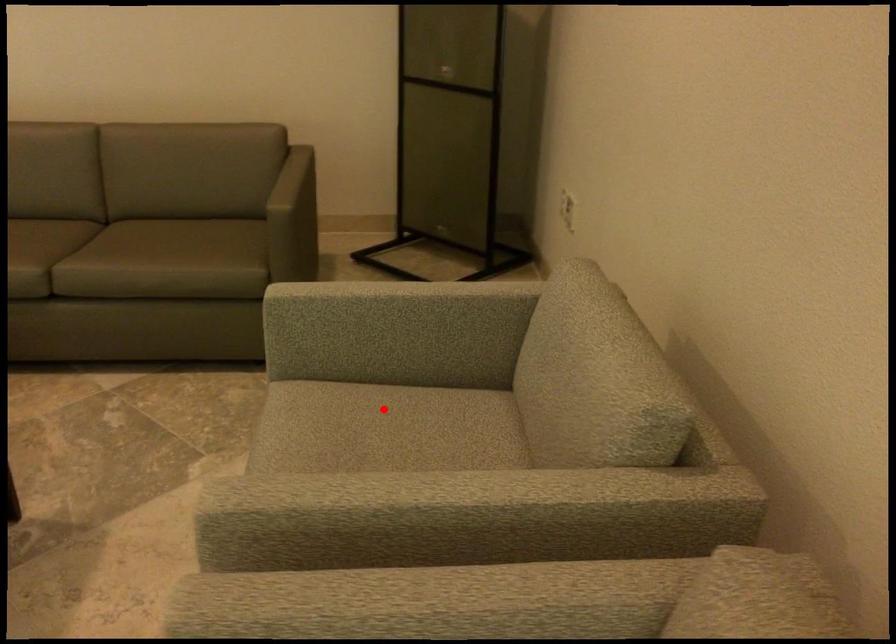
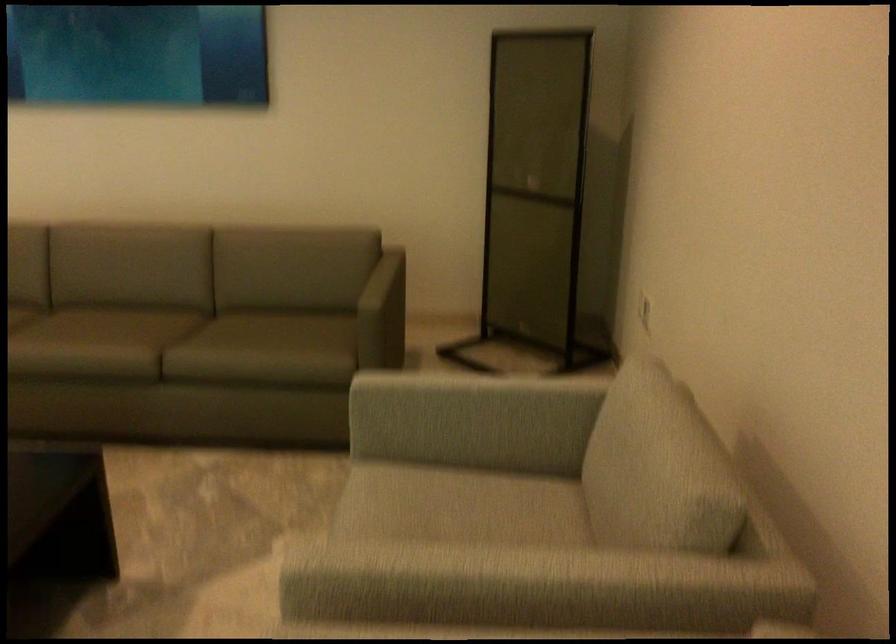
Locate, in the second image, the point that corresponds to the highlighted location in the first image.

(455, 491)